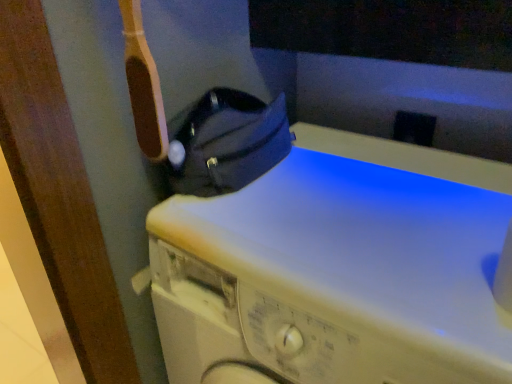
Question: Is white matte washing machine at center shorter than black leather bag at upper left?

Choices:
 (A) no
 (B) yes

Answer: (A)

Question: Considering the relative sizes of white matte washing machine at center and black leather bag at upper left in the image provided, is white matte washing machine at center smaller than black leather bag at upper left?

Choices:
 (A) no
 (B) yes

Answer: (A)

Question: Is white matte washing machine at center positioned with its back to black leather bag at upper left?

Choices:
 (A) no
 (B) yes

Answer: (A)

Question: From the image's perspective, is white matte washing machine at center under black leather bag at upper left?

Choices:
 (A) yes
 (B) no

Answer: (A)

Question: From the image's perspective, is white matte washing machine at center on black leather bag at upper left?

Choices:
 (A) yes
 (B) no

Answer: (B)

Question: From a real-world perspective, is white matte washing machine at center located beneath black leather bag at upper left?

Choices:
 (A) yes
 (B) no

Answer: (A)

Question: Is the position of black leather bag at upper left more distant than that of white matte washing machine at center?

Choices:
 (A) yes
 (B) no

Answer: (A)

Question: Can you confirm if black leather bag at upper left is shorter than white matte washing machine at center?

Choices:
 (A) yes
 (B) no

Answer: (A)

Question: Can you confirm if black leather bag at upper left is wider than white matte washing machine at center?

Choices:
 (A) yes
 (B) no

Answer: (B)

Question: Is black leather bag at upper left positioned beyond the bounds of white matte washing machine at center?

Choices:
 (A) yes
 (B) no

Answer: (A)

Question: Is black leather bag at upper left looking in the opposite direction of white matte washing machine at center?

Choices:
 (A) no
 (B) yes

Answer: (A)

Question: Is black leather bag at upper left smaller than white matte washing machine at center?

Choices:
 (A) no
 (B) yes

Answer: (B)

Question: Is white matte washing machine at center wider or thinner than black leather bag at upper left?

Choices:
 (A) wide
 (B) thin

Answer: (A)